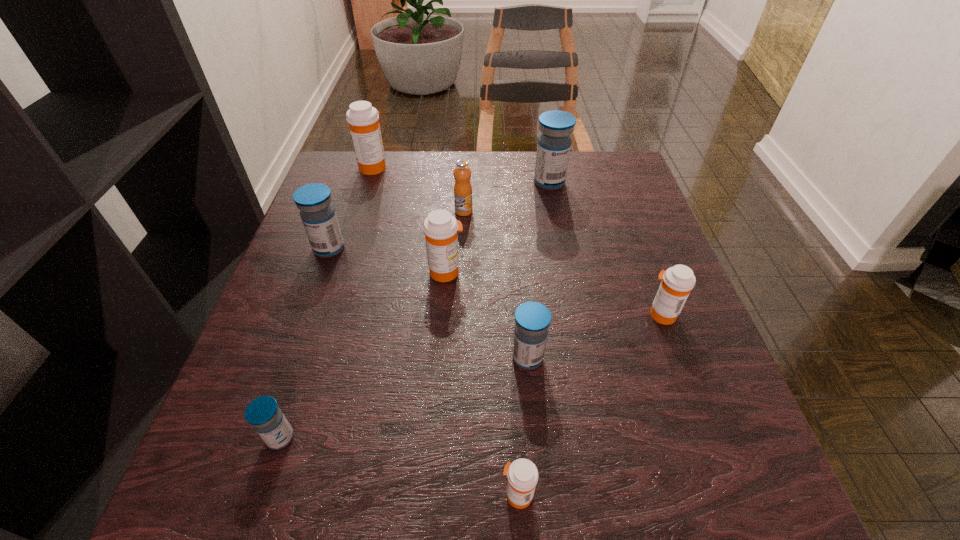
This screenshot has height=540, width=960. In order to click on the rightmost blue medicine in this screenshot , I will do `click(554, 143)`.

The width and height of the screenshot is (960, 540). What are the coordinates of `the farthest blue medicine` in the screenshot? It's located at (554, 143).

Find the location of a particular element. This screenshot has height=540, width=960. the leftmost orange medicine is located at coordinates (362, 118).

Where is `the biggest orange medicine`? the biggest orange medicine is located at coordinates (362, 118).

Locate an element on the screen. Image resolution: width=960 pixels, height=540 pixels. the fifth nearest medicine is located at coordinates coord(440,228).

This screenshot has height=540, width=960. I want to click on the third smallest orange medicine, so click(x=440, y=228).

In order to click on the second biggest blue medicine in this screenshot , I will do `click(317, 213)`.

The width and height of the screenshot is (960, 540). In order to click on the sixth nearest object in this screenshot , I will do `click(317, 213)`.

Where is `orange juice`? orange juice is located at coordinates (463, 203).

Image resolution: width=960 pixels, height=540 pixels. What are the coordinates of `the second nearest blue medicine` in the screenshot? It's located at (532, 319).